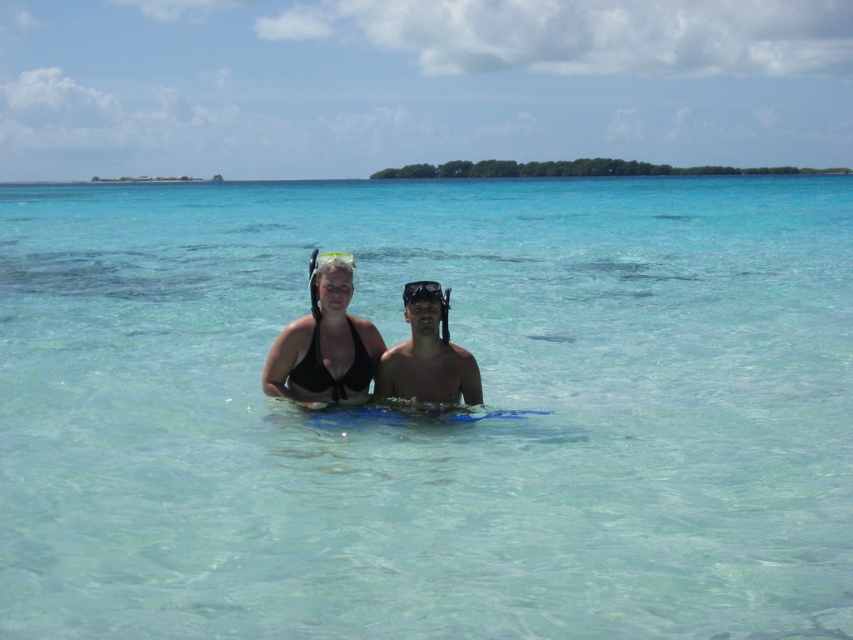
Does clear water at center have a lesser width compared to black matte bikini top at center?

No.

You are a GUI agent. You are given a task and a screenshot of the screen. Output one action in this format:
    pyautogui.click(x=<x>, y=<y>)
    Task: Click on the clear water at center
    The width and height of the screenshot is (853, 640).
    Given the screenshot: What is the action you would take?
    pyautogui.click(x=433, y=422)

Locate an element on the screen. clear water at center is located at coordinates (433, 422).

Does transparent plastic goggles at center appear under clear plastic goggles at upper center?

Yes.

Does transparent plastic goggles at center appear on the right side of clear plastic goggles at upper center?

Correct, you'll find transparent plastic goggles at center to the right of clear plastic goggles at upper center.

Identify the location of transparent plastic goggles at center. (422, 291).

Image resolution: width=853 pixels, height=640 pixels. I want to click on transparent plastic goggles at center, so click(422, 291).

Can you confirm if black matte bikini top at center is positioned above transparent plastic goggles at center?

No.

Between point (323, 333) and point (431, 294), which one is positioned behind?

Positioned behind is point (323, 333).

Which is behind, point (317, 323) or point (407, 298)?

Positioned behind is point (317, 323).

You are a GUI agent. You are given a task and a screenshot of the screen. Output one action in this format:
    pyautogui.click(x=<x>, y=<y>)
    Task: Click on the black matte bikini top at center
    Image resolution: width=853 pixels, height=640 pixels.
    Given the screenshot: What is the action you would take?
    pyautogui.click(x=323, y=346)